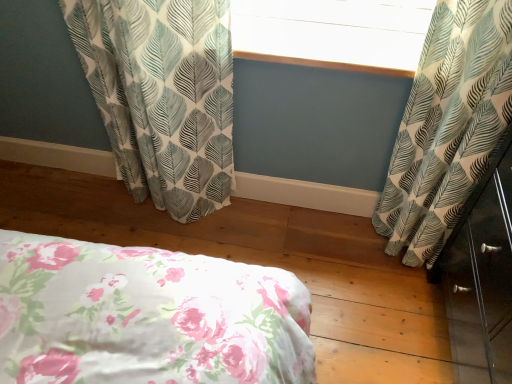
Locate an element on the screen. empty space that is to the right of white leaf-patterned curtain at left, which is the second curtain in right-to-left order is located at coordinates (273, 235).